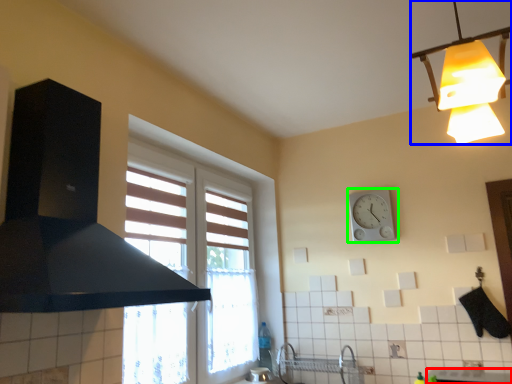
Question: Which object is positioned closest to counter top (highlighted by a red box)? Select from lamp (highlighted by a blue box) and wall clock (highlighted by a green box).

Choices:
 (A) lamp
 (B) wall clock

Answer: (B)